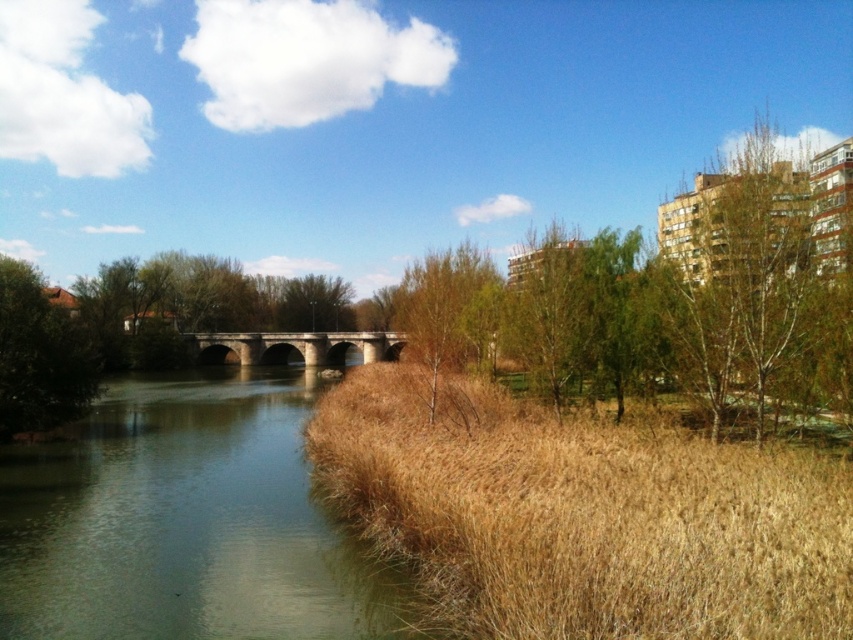
Question: Among these objects, which one is farthest from the camera?

Choices:
 (A) brown wood tree at left
 (B) green matte tree at center

Answer: (A)

Question: Which object appears farthest from the camera in this image?

Choices:
 (A) green leafy tree at center
 (B) brown wood tree at left
 (C) green matte tree at center
 (D) brown dry grass at lower right

Answer: (A)

Question: Does brown dry grass at lower right have a larger size compared to green leafy tree at center?

Choices:
 (A) no
 (B) yes

Answer: (A)

Question: Does brown dry grass at lower right have a lesser width compared to brown wood tree at left?

Choices:
 (A) no
 (B) yes

Answer: (B)

Question: Which of the following is the closest to the observer?

Choices:
 (A) (459, 349)
 (B) (267, 355)
 (C) (761, 387)

Answer: (C)

Question: Does green leafy tree at upper right lie behind green matte tree at center?

Choices:
 (A) no
 (B) yes

Answer: (A)